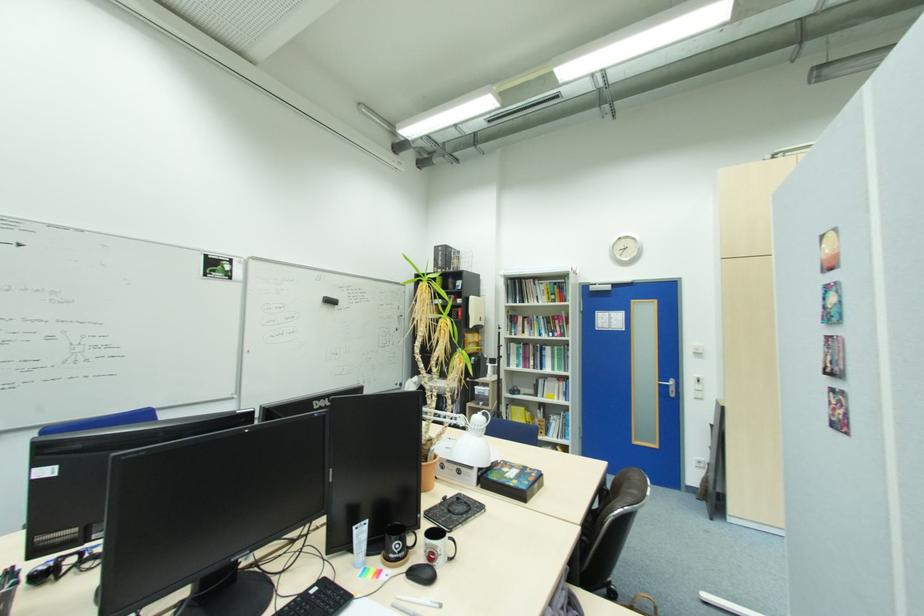
Where is `white lamp head`? The image size is (924, 616). white lamp head is located at coordinates (470, 450).